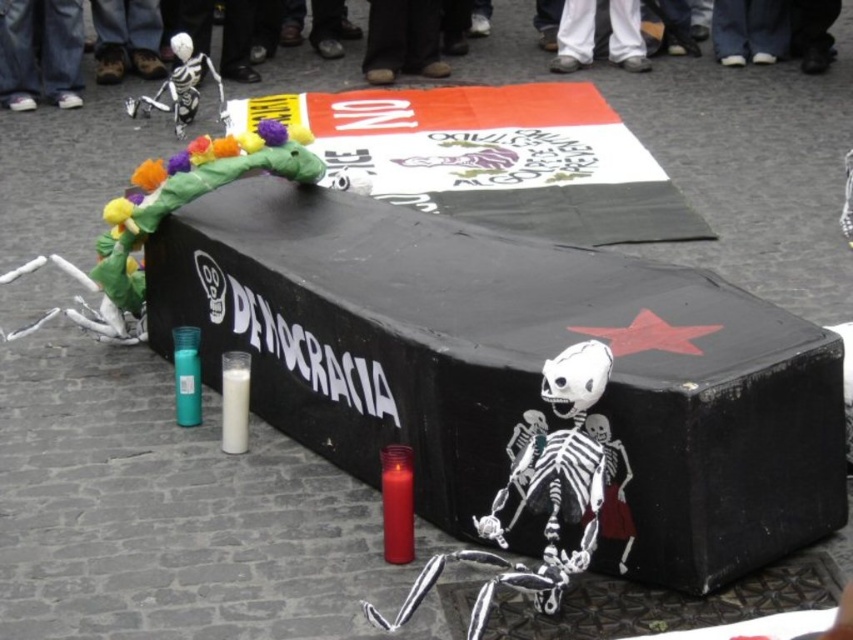
You are an art curator examining this symbolic artwork. You need to determine the relative sizes of the objects in the scene. Which object is larger between the white plastic skeleton at upper center and the jeans at upper left?

→ The white plastic skeleton at upper center is much taller than the jeans at upper left, making it the larger object between the two.

You are an art curator examining the symbolic artwork described. You notice the white plastic skeleton at upper center located at point [728,81]. Can you determine the exact coordinates of this skeleton?

The white plastic skeleton at upper center is located exactly at point [728,81].

You are an art curator examining the symbolic artwork. In the scene, you notice the white plastic skeleton at upper center and the jeans at upper left. Which object is located above the other?

The white plastic skeleton at upper center is positioned over jeans at upper left.